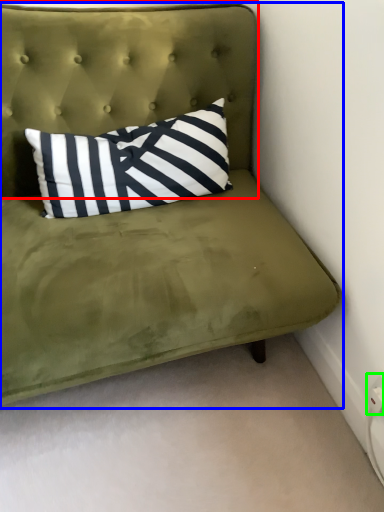
Question: Based on their relative distances, which object is farther from headboard (highlighted by a red box)? Choose from studio couch (highlighted by a blue box) and electric outlet (highlighted by a green box).

Choices:
 (A) studio couch
 (B) electric outlet

Answer: (B)